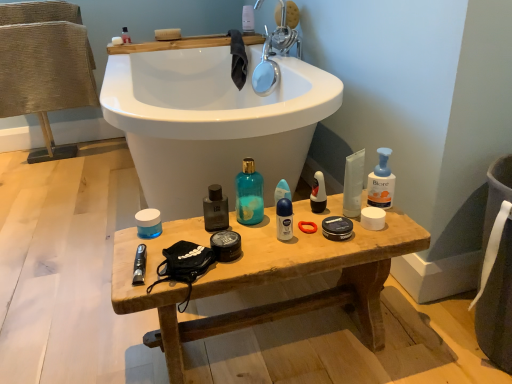
You are a GUI agent. You are given a task and a screenshot of the screen. Output one action in this format:
    pyautogui.click(x=<x>, y=<y>)
    Task: Click on the free location in front of matte black deodorant at center, which ranks as the third toiletry in top-to-bottom order
    The width and height of the screenshot is (512, 384).
    Given the screenshot: What is the action you would take?
    pyautogui.click(x=322, y=236)